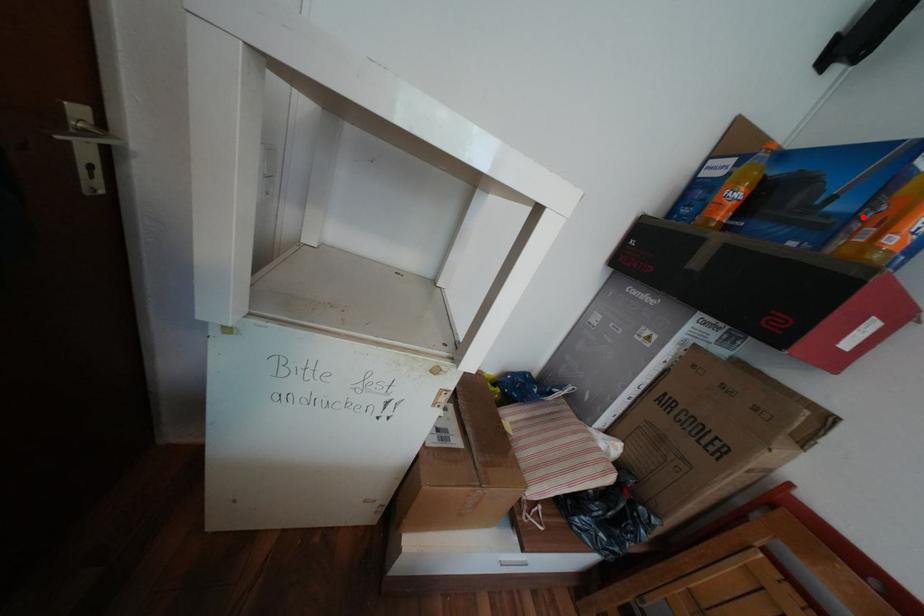
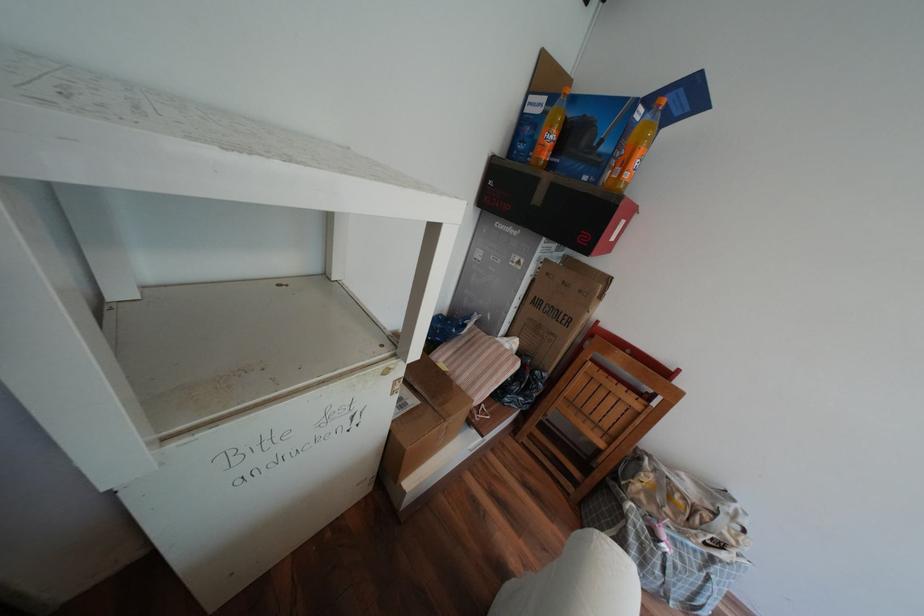
Question: I am providing you with two images of the same scene from different viewpoints. In image1, a red point is highlighted. Considering the same 3D point in image2, which of the following is correct?

Choices:
 (A) It is closer
 (B) It is farther

Answer: (A)